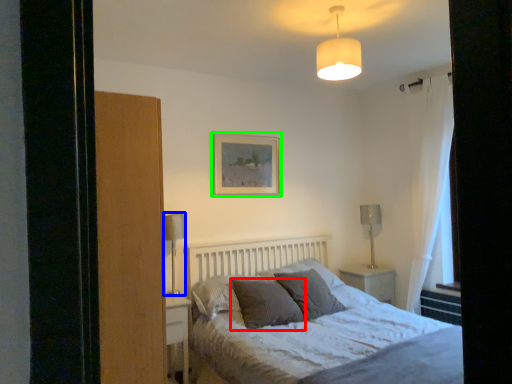
Question: Based on their relative distances, which object is farther from pillow (highlighted by a red box)? Choose from table lamp (highlighted by a blue box) and picture frame (highlighted by a green box).

Choices:
 (A) table lamp
 (B) picture frame

Answer: (B)